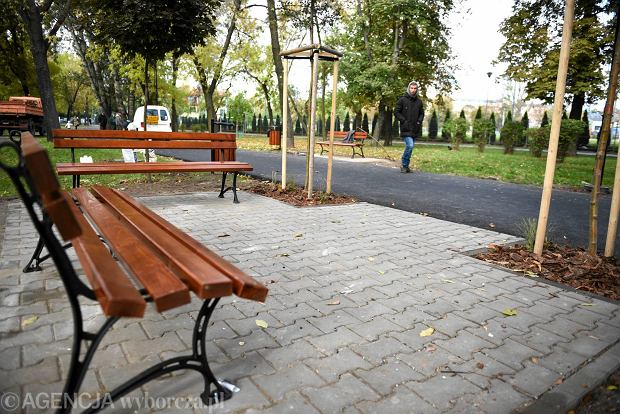
Find the location of a particular element. The width and height of the screenshot is (620, 414). seat is located at coordinates (190, 271).